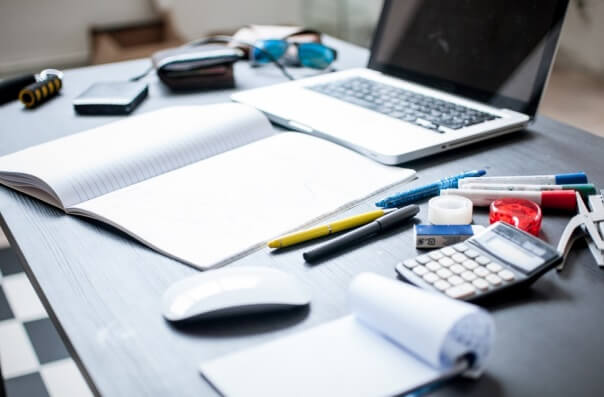
Where is `writing tools`? The height and width of the screenshot is (397, 604). writing tools is located at coordinates (396, 217), (504, 180), (501, 187), (493, 197), (342, 223), (416, 192).